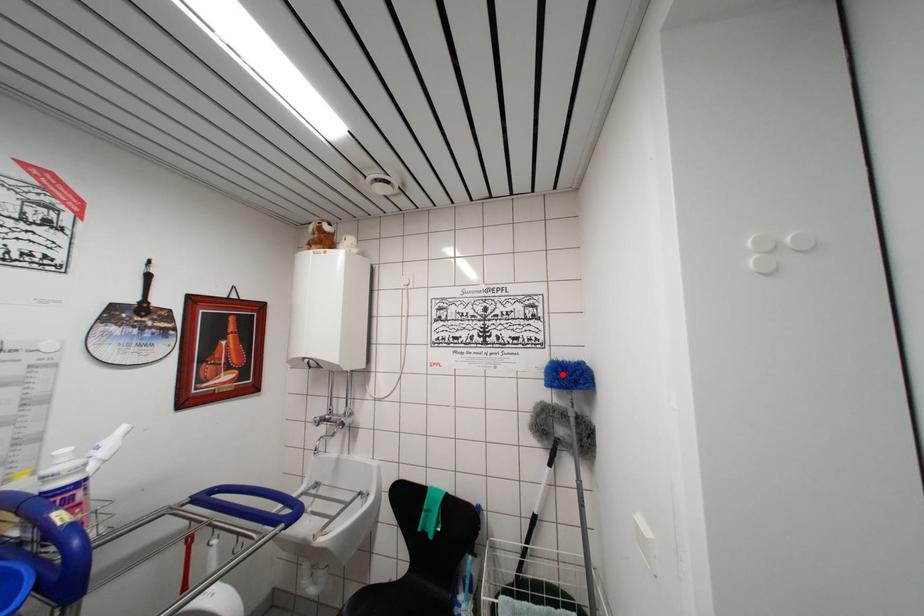
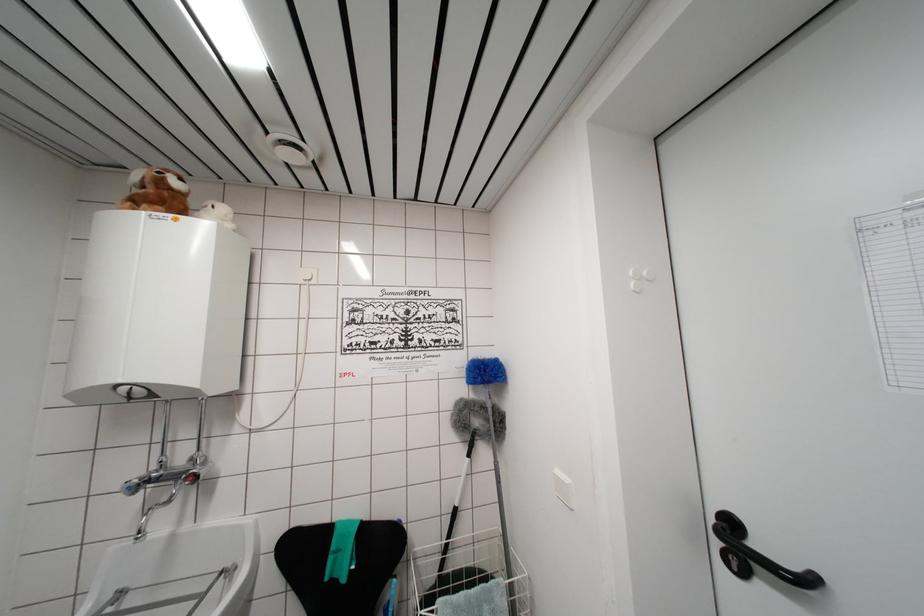
Question: I am providing you with two images of the same scene from different viewpoints. A red point is marked on the first image. Is the red point's position out of view in image 2?

Choices:
 (A) Yes
 (B) No

Answer: (B)